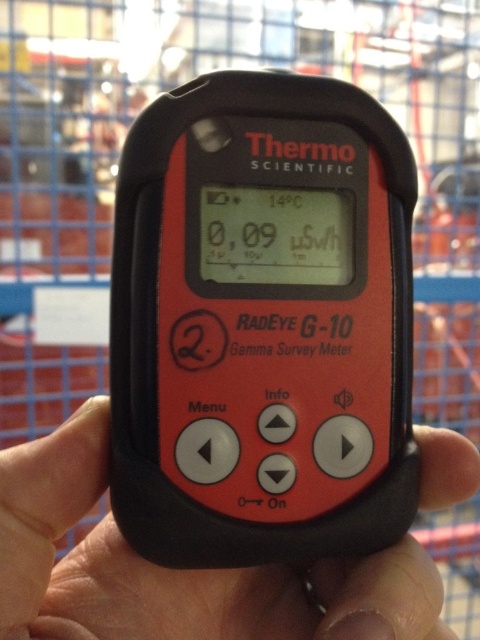
Question: Is matte black thermometer at center closer to the viewer compared to black matte hand at center?

Choices:
 (A) yes
 (B) no

Answer: (B)

Question: Can you confirm if matte black thermometer at center is positioned above black matte hand at center?

Choices:
 (A) no
 (B) yes

Answer: (B)

Question: Where is matte black thermometer at center located in relation to black matte hand at center in the image?

Choices:
 (A) right
 (B) left

Answer: (A)

Question: Which point is closer to the camera?

Choices:
 (A) matte black thermometer at center
 (B) black matte hand at center

Answer: (B)

Question: Which of the following is the closest to the observer?

Choices:
 (A) (385, 131)
 (B) (76, 432)

Answer: (B)